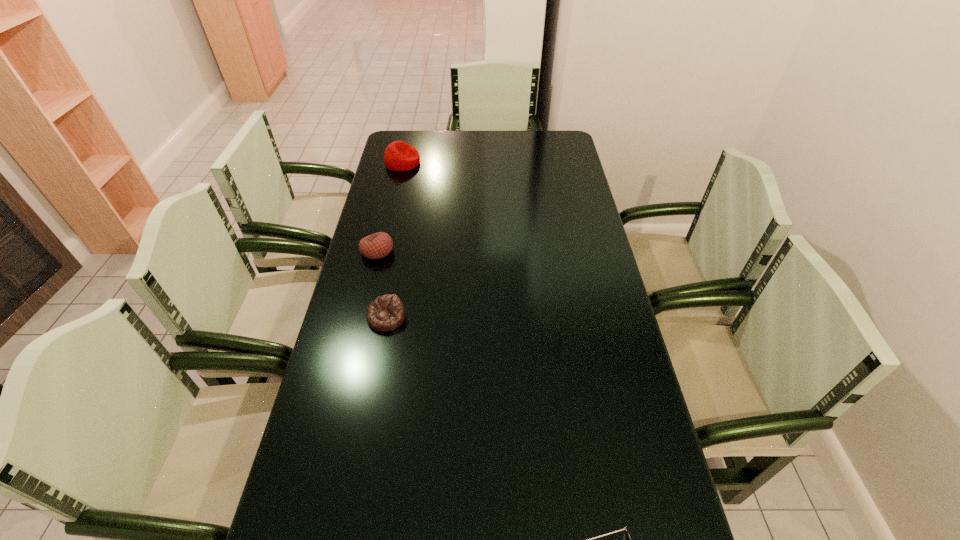
The image size is (960, 540). I want to click on object present at the far left corner, so [399, 156].

The image size is (960, 540). Find the location of `free space at the left edge of the desktop`. free space at the left edge of the desktop is located at coordinates (367, 295).

The image size is (960, 540). What are the coordinates of `vacant area at the right edge of the desktop` in the screenshot? It's located at pos(573,164).

You are a GUI agent. You are given a task and a screenshot of the screen. Output one action in this format:
    pyautogui.click(x=<x>, y=<y>)
    Task: Click on the vacant position at the far right corner of the desktop
    This screenshot has width=960, height=540.
    Given the screenshot: What is the action you would take?
    pyautogui.click(x=535, y=152)

At what (x,y) coordinates should I click in order to perform the action: click on free point between the second farthest object and the farthest beanbag. Please return your answer as a coordinate pair (x, y). The width and height of the screenshot is (960, 540). Looking at the image, I should click on (390, 207).

Locate an element on the screen. The height and width of the screenshot is (540, 960). empty space that is in between the farthest object and the second nearest beanbag is located at coordinates (390, 207).

The height and width of the screenshot is (540, 960). I want to click on empty space that is in between the shortest beanbag and the second farthest beanbag, so click(x=382, y=285).

The image size is (960, 540). Find the location of `vacant point located between the second nearest object and the third nearest object`. vacant point located between the second nearest object and the third nearest object is located at coordinates (382, 285).

Choose which object is the third nearest neighbor to the shortest beanbag. Please provide its 2D coordinates. Your answer should be formatted as a tuple, i.e. [(x, y)], where the tuple contains the x and y coordinates of a point satisfying the conditions above.

[(399, 156)]

In order to click on the third closest object relative to the shortest beanbag in this screenshot , I will do `click(399, 156)`.